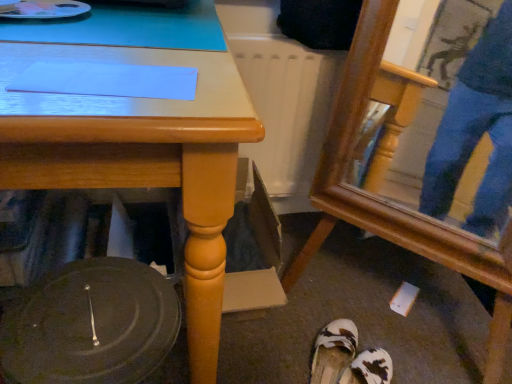
The image size is (512, 384). What are the coordinates of `vacant space situated above matte wood desk at center (from a real-world perspective)` in the screenshot? It's located at (99, 39).